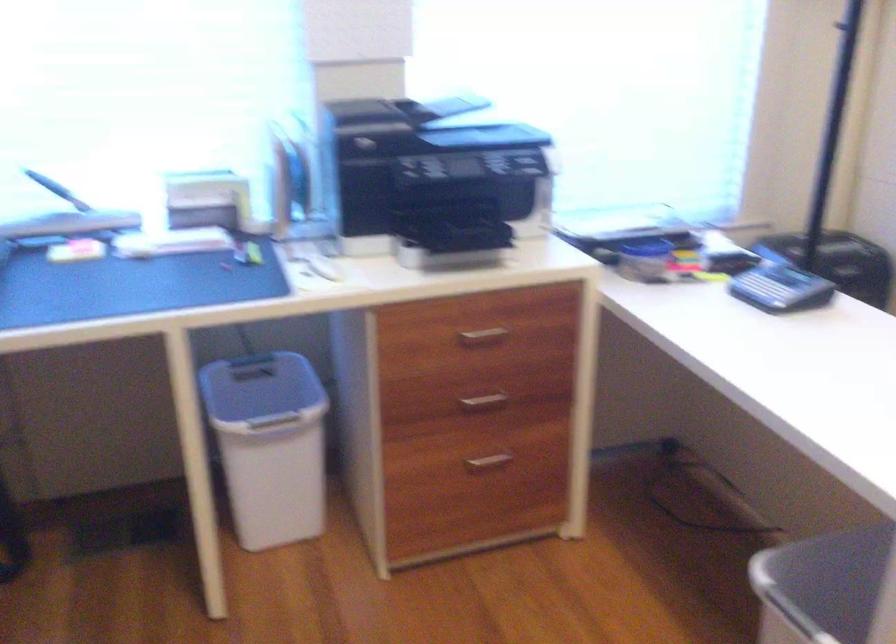
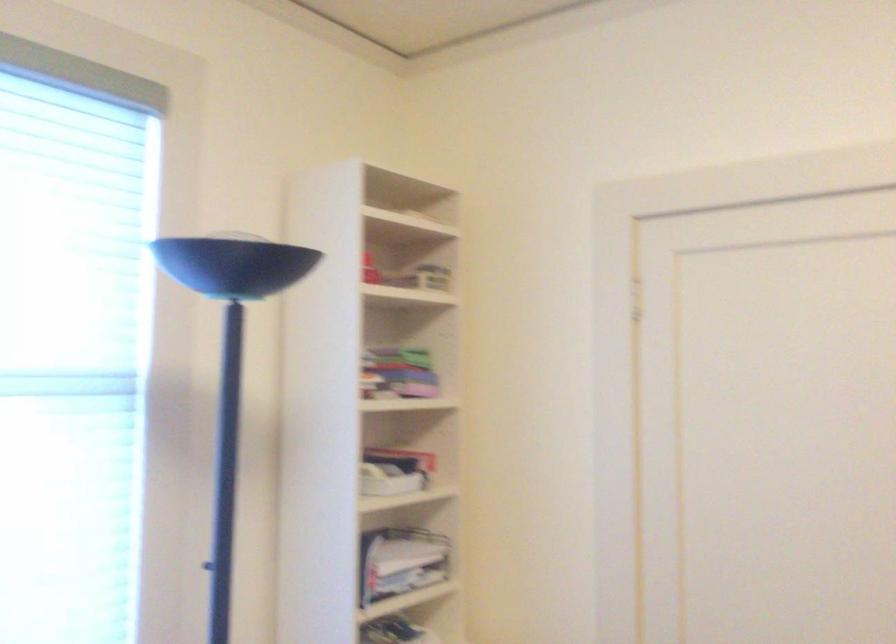
How did the camera likely rotate?

The camera rotated toward right-up.